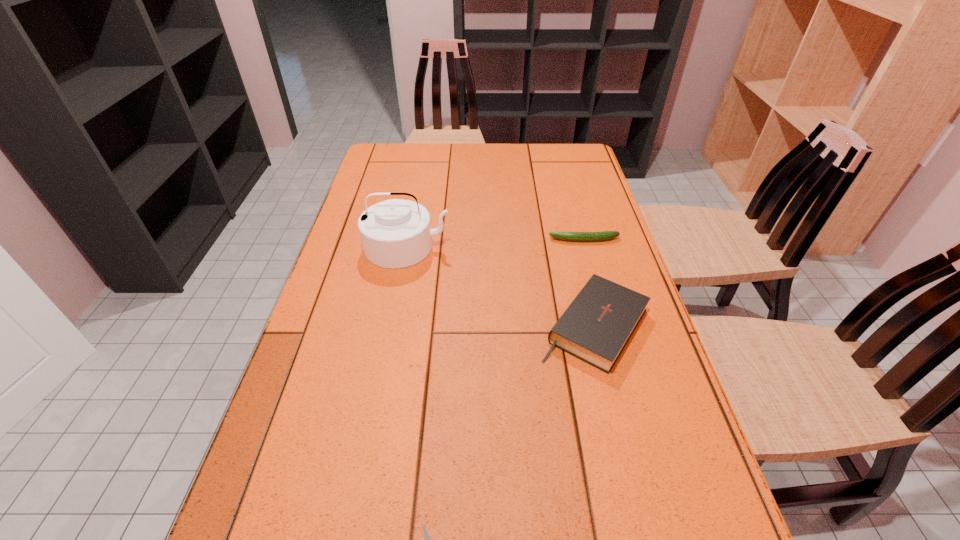
Where is `vacant space that's between the zucchini and the tallest object`? This screenshot has width=960, height=540. vacant space that's between the zucchini and the tallest object is located at coordinates (495, 243).

Identify the location of vacant space that is in between the Bible and the tallest object. (501, 286).

Locate an element on the screen. This screenshot has width=960, height=540. object that ranks as the third closest to the third shortest object is located at coordinates (427, 538).

This screenshot has width=960, height=540. What are the coordinates of `object that is the third closest to the third tallest object` in the screenshot? It's located at (427, 538).

Where is `free space that satisfies the following two spatial constraints: 1. on the spout of the tallest object; 2. on the right side of the third shortest object`? The image size is (960, 540). free space that satisfies the following two spatial constraints: 1. on the spout of the tallest object; 2. on the right side of the third shortest object is located at coordinates (392, 326).